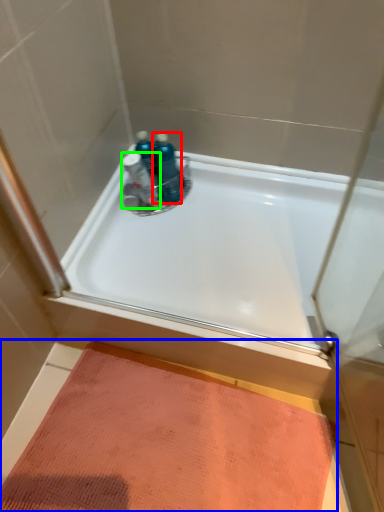
Question: Estimate the real-world distances between objects in this image. Which object is closer to toiletry (highlighted by a red box), doormat (highlighted by a blue box) or toiletry (highlighted by a green box)?

Choices:
 (A) doormat
 (B) toiletry

Answer: (B)